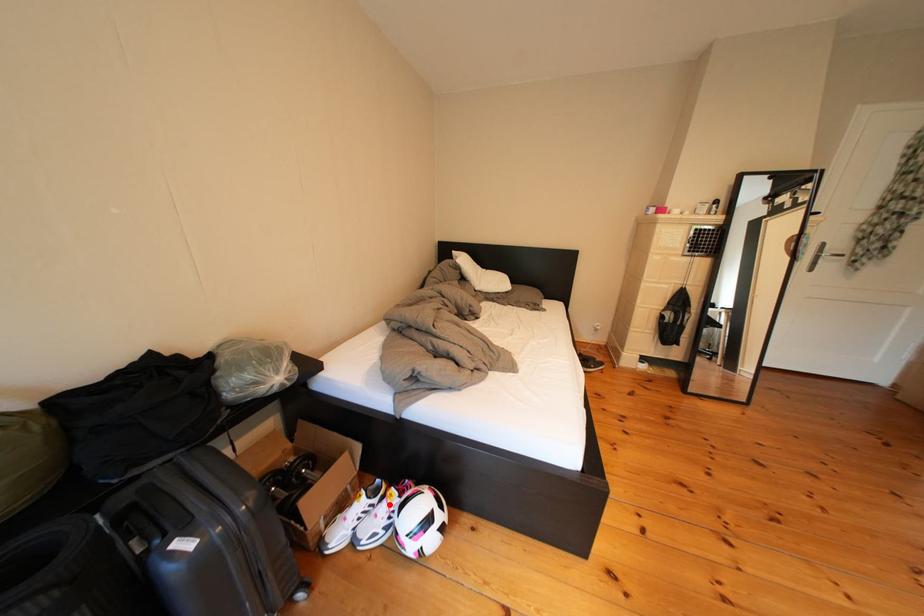
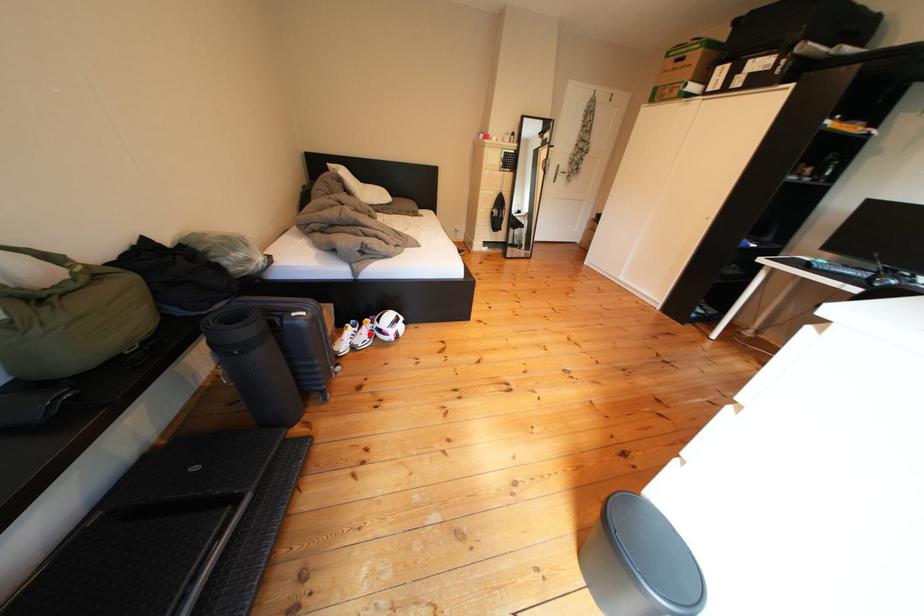
I am providing you with two images of the same scene from different viewpoints. A red point is marked on the first image and another point is marked on the second image. Are the points marked in image1 and image2 representing the same 3D position?

Yes